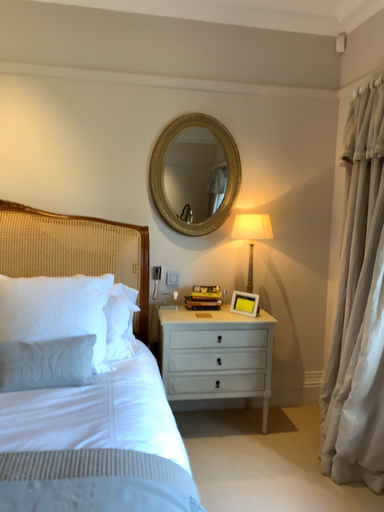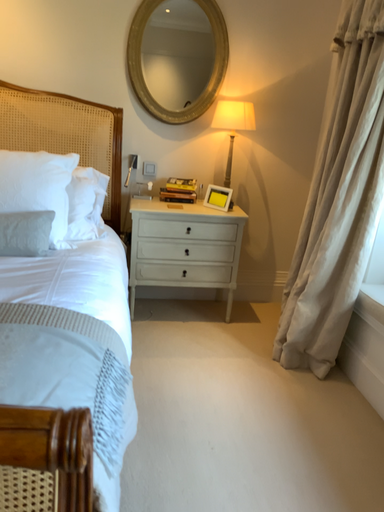
Question: How did the camera likely rotate when shooting the video?

Choices:
 (A) rotated downward
 (B) rotated upward

Answer: (A)